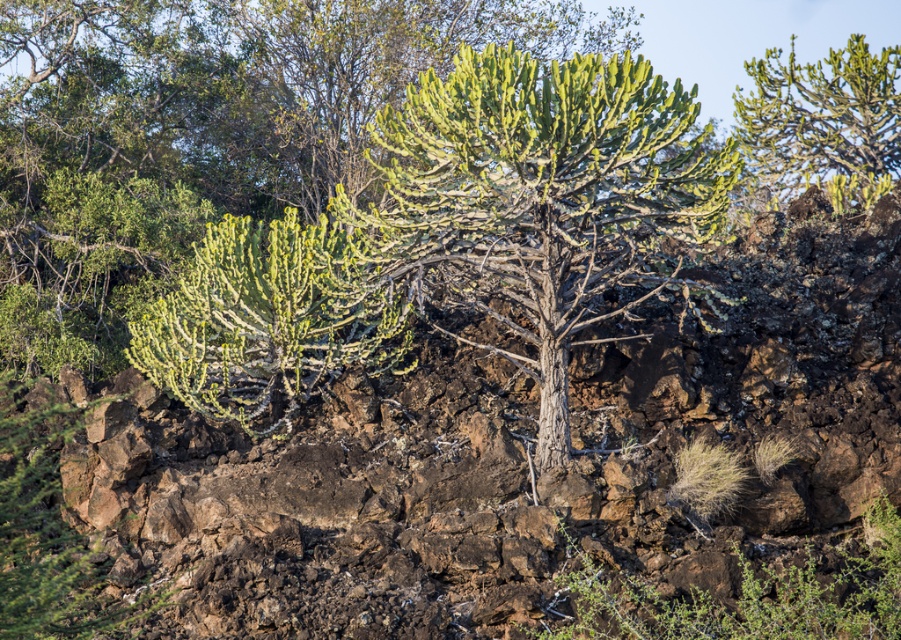
Question: Which is nearer to the green spiny plant at upper right?

Choices:
 (A) green spiny plant at center
 (B) green succulent at center

Answer: (A)

Question: Considering the real-world distances, which object is farthest from the green spiny plant at center?

Choices:
 (A) green succulent at center
 (B) green spiny plant at upper right

Answer: (B)

Question: Which of the following is the closest to the observer?

Choices:
 (A) green succulent at center
 (B) green spiny plant at upper right
 (C) green spiny plant at center

Answer: (C)

Question: Does green spiny plant at center have a smaller size compared to green succulent at center?

Choices:
 (A) yes
 (B) no

Answer: (B)

Question: Can you confirm if green spiny plant at center is positioned below green spiny plant at upper right?

Choices:
 (A) no
 (B) yes

Answer: (B)

Question: Can you confirm if green spiny plant at center is wider than green spiny plant at upper right?

Choices:
 (A) no
 (B) yes

Answer: (B)